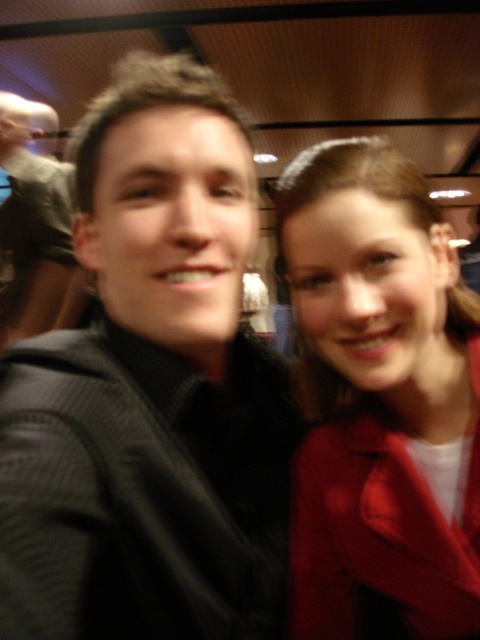
You are a photographer setting up for a group photo. You need to position two subjects so that they are exactly 1.65 meters apart. Given the current scene, can the matte red coat at right and matte black sweater at center be positioned correctly for your shot?

The distance between the matte red coat at right and matte black sweater at center is already 1.65 meters, so they are positioned correctly for your shot.

You are standing at the position of the point marked at coordinates (388, 424) in the image. You want to take a step forward towards the direction you are facing. Considering the distance from your current position to the nearest obstacle, is it safe to take this step without bumping into anything?

The point at coordinates (388, 424) is 61.61 centimeters away from the viewer. Since there are no obstacles mentioned in the scene description, it is safe to take a step forward as there are no nearby obstacles to collide with.